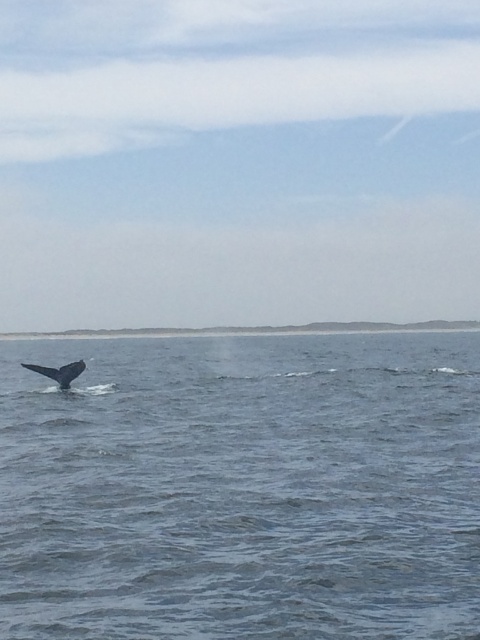
Does blue water at lower left have a smaller size compared to gray matte whale tail at lower left?

Incorrect, blue water at lower left is not smaller in size than gray matte whale tail at lower left.

Can you confirm if blue water at lower left is taller than gray matte whale tail at lower left?

Indeed, blue water at lower left has a greater height compared to gray matte whale tail at lower left.

Which is behind, point (450, 525) or point (48, 369)?

Point (48, 369)

Find the location of a particular element. Image resolution: width=480 pixels, height=640 pixels. blue water at lower left is located at coordinates (241, 488).